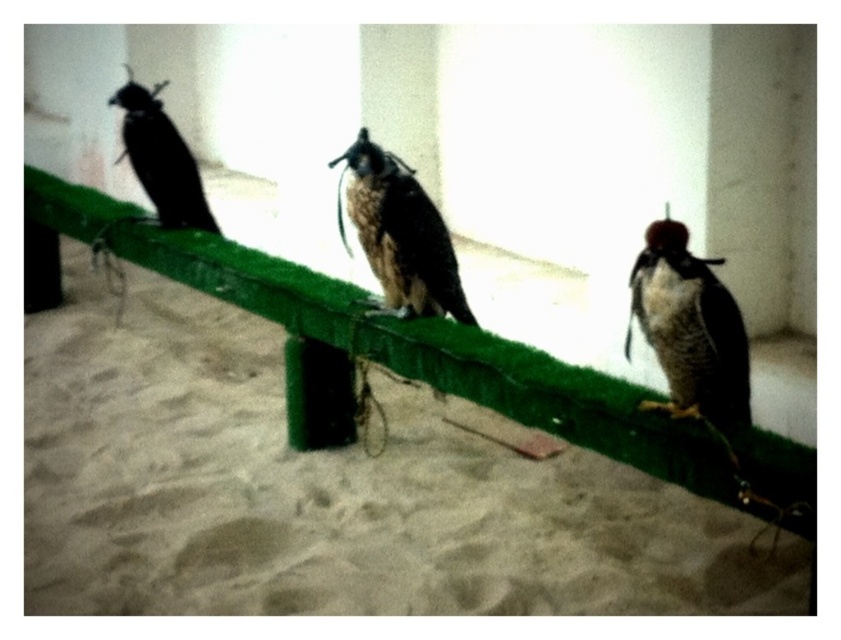
Question: Which point is closer to the camera?

Choices:
 (A) (776, 497)
 (B) (183, 193)
 (C) (667, 336)

Answer: (A)

Question: Is dark brown feathers at right to the right of black matte falcon at left from the viewer's perspective?

Choices:
 (A) no
 (B) yes

Answer: (B)

Question: Considering the real-world distances, which object is closest to the green artificial grass at center?

Choices:
 (A) black matte falcon at left
 (B) dark brown feathers at right

Answer: (B)

Question: Does dark brown feathers at right appear over black matte falcon at left?

Choices:
 (A) yes
 (B) no

Answer: (B)

Question: Can you confirm if green artificial grass at center is wider than dark brown feathers at right?

Choices:
 (A) no
 (B) yes

Answer: (B)

Question: Estimate the real-world distances between objects in this image. Which object is closer to the brown feathered falcon at center?

Choices:
 (A) black matte falcon at left
 (B) green artificial grass at center

Answer: (B)